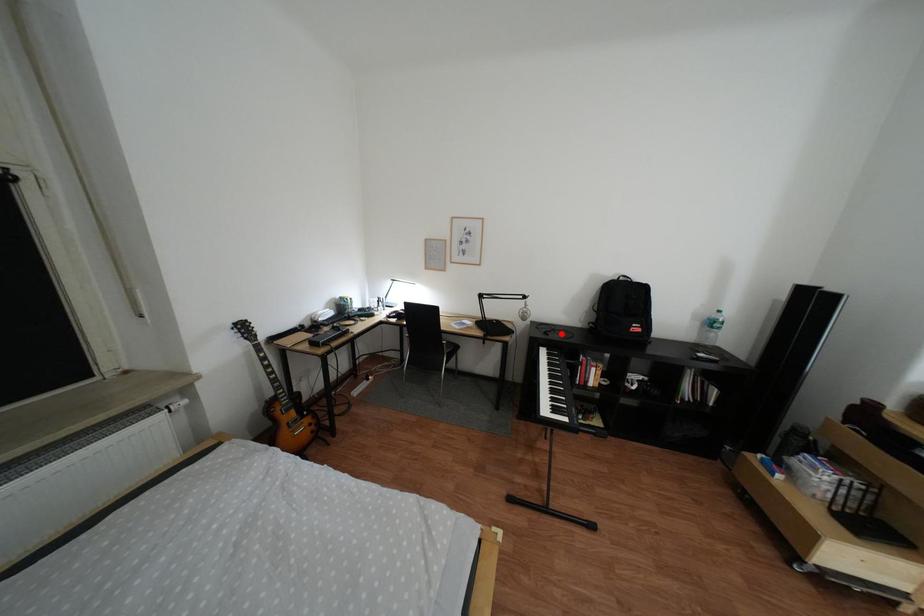
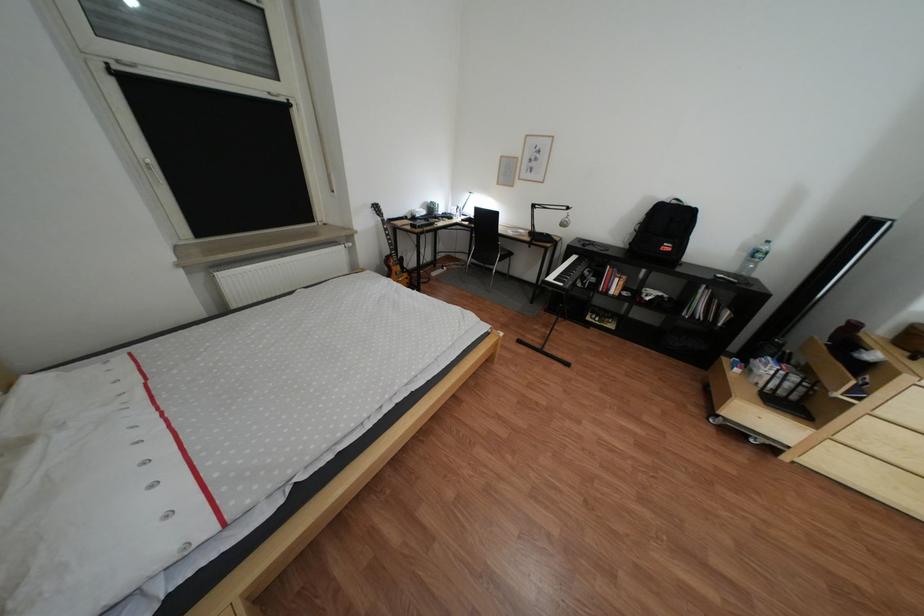
Question: I am providing you with two images of the same scene from different viewpoints. In image1, a red point is highlighted. Considering the same 3D point in image2, which of the following is correct?

Choices:
 (A) It is closer
 (B) It is farther

Answer: (A)